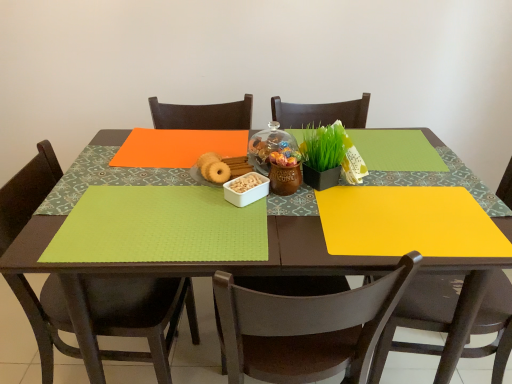
Image resolution: width=512 pixels, height=384 pixels. Find the location of `vacant point above lime green fabric placemat at lower left (from a real-world perspective)`. vacant point above lime green fabric placemat at lower left (from a real-world perspective) is located at coordinates (168, 216).